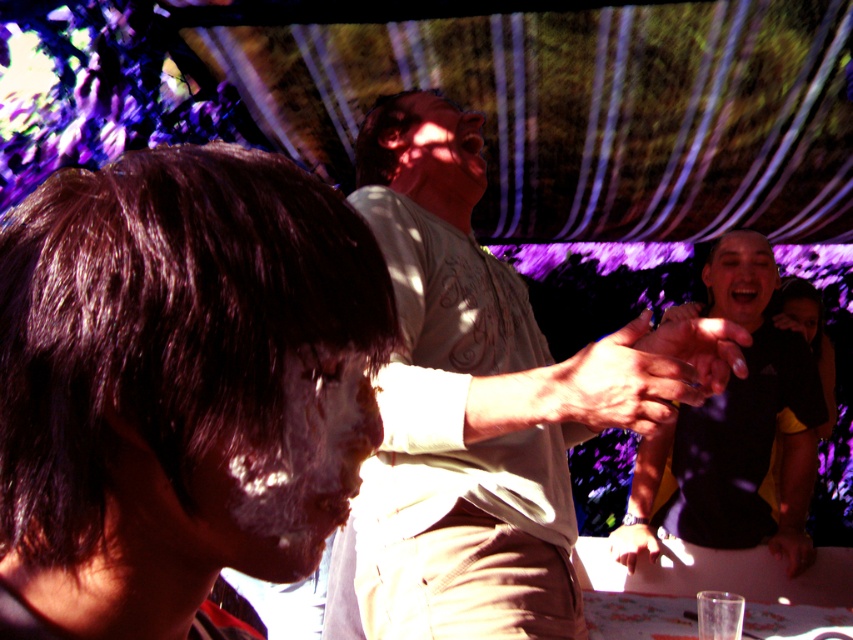
Can you confirm if light beige shirt at center is wider than black matte shirt at right?

Incorrect, light beige shirt at center's width does not surpass black matte shirt at right's.

Which is behind, point (375, 109) or point (647, 500)?

Positioned behind is point (647, 500).

Where is `light beige shirt at center`? light beige shirt at center is located at coordinates (471, 404).

Between white matte face paint at center and black matte shirt at right, which one is positioned higher?

white matte face paint at center is above.

How far apart are white matte face paint at center and black matte shirt at right?

white matte face paint at center is 1.75 meters from black matte shirt at right.

You are a GUI agent. You are given a task and a screenshot of the screen. Output one action in this format:
    pyautogui.click(x=<x>, y=<y>)
    Task: Click on the white matte face paint at center
    
    Given the screenshot: What is the action you would take?
    pyautogui.click(x=181, y=380)

You are a GUI agent. You are given a task and a screenshot of the screen. Output one action in this format:
    pyautogui.click(x=<x>, y=<y>)
    Task: Click on the white matte face paint at center
    
    Given the screenshot: What is the action you would take?
    pyautogui.click(x=181, y=380)

Does white matte face paint at center appear on the right side of smooth skin hand at center?

No, white matte face paint at center is not to the right of smooth skin hand at center.

In the scene shown: Can you confirm if white matte face paint at center is taller than smooth skin hand at center?

Correct, white matte face paint at center is much taller as smooth skin hand at center.

Between point (44, 282) and point (625, 545), which one is positioned behind?

The point (625, 545) is more distant.

Find the location of a particular element. white matte face paint at center is located at coordinates (181, 380).